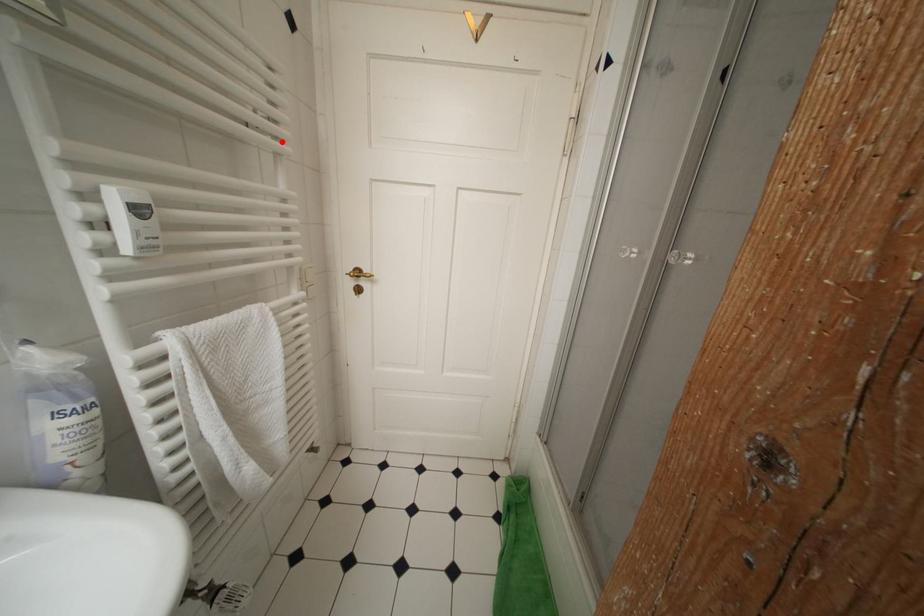
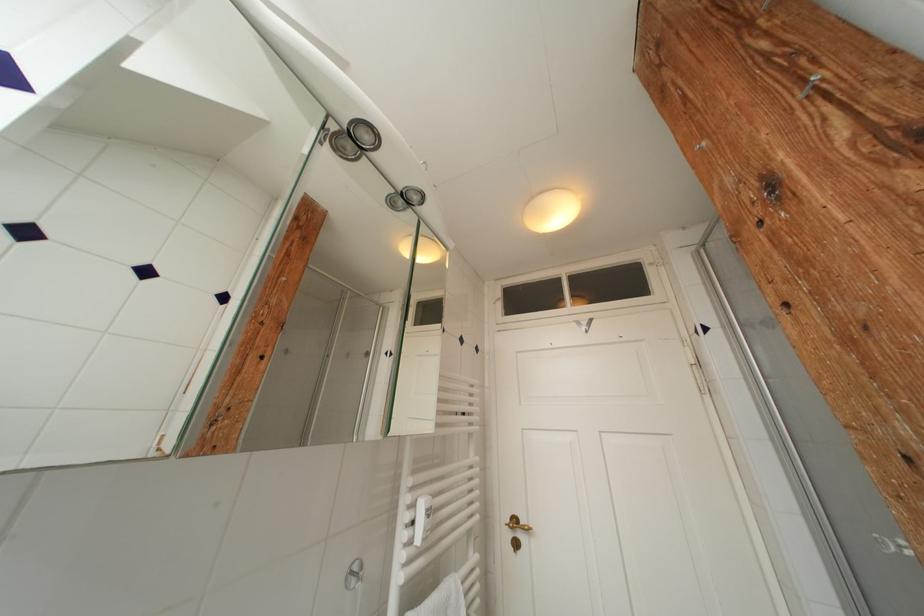
Find the pixel in the second image that matches the highlighted location in the first image.

(478, 427)